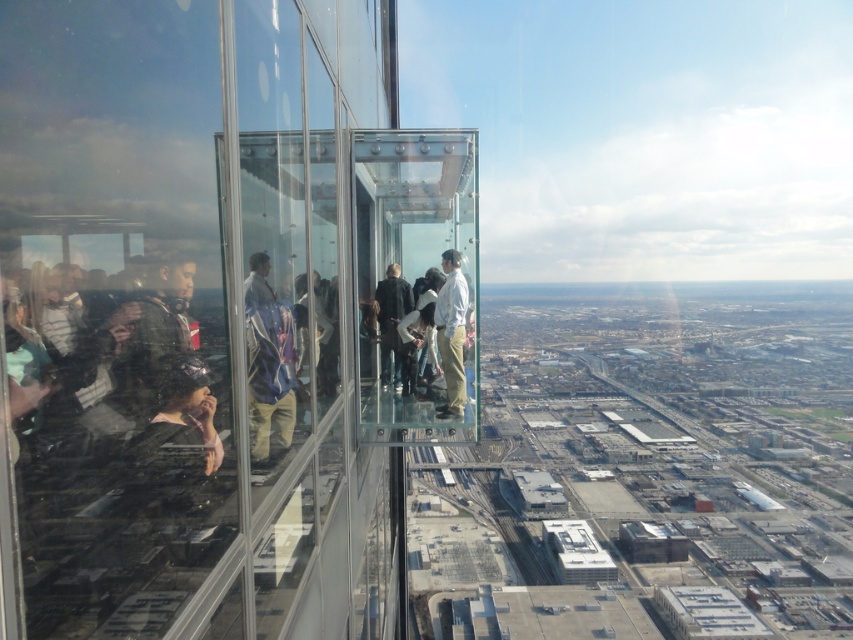
Question: Which point is closer to the camera?

Choices:
 (A) (308, 253)
 (B) (196, 424)

Answer: (B)

Question: Which of these objects is positioned closest to the blue fabric jacket at left?

Choices:
 (A) dark brown leather jacket at center
 (B) transparent glass elevator at center
 (C) matte black jacket at left

Answer: (C)

Question: Does matte black jacket at left have a larger size compared to light blue shirt at center?

Choices:
 (A) yes
 (B) no

Answer: (A)

Question: Does blue fabric jacket at left have a lesser width compared to dark brown leather jacket at center?

Choices:
 (A) no
 (B) yes

Answer: (A)

Question: Does transparent glass elevator at center appear under dark brown leather jacket at center?

Choices:
 (A) no
 (B) yes

Answer: (A)

Question: Which point is farther from the camera taking this photo?

Choices:
 (A) (392, 355)
 (B) (30, 204)
 (C) (187, 353)

Answer: (A)